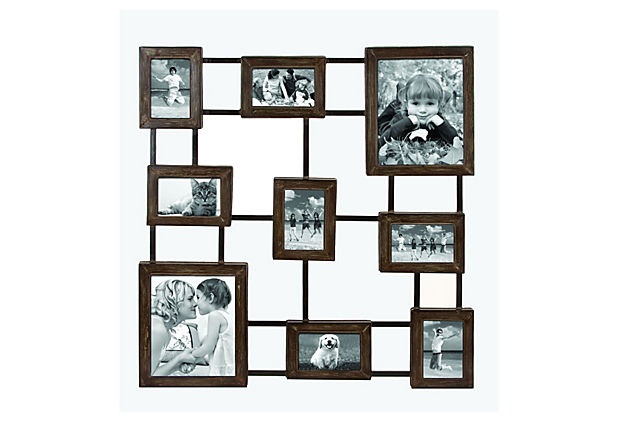
Locate an element on the screen. pictures is located at coordinates (175, 81), (270, 85), (414, 108), (422, 247), (299, 222), (198, 199), (193, 321), (337, 347), (428, 342).